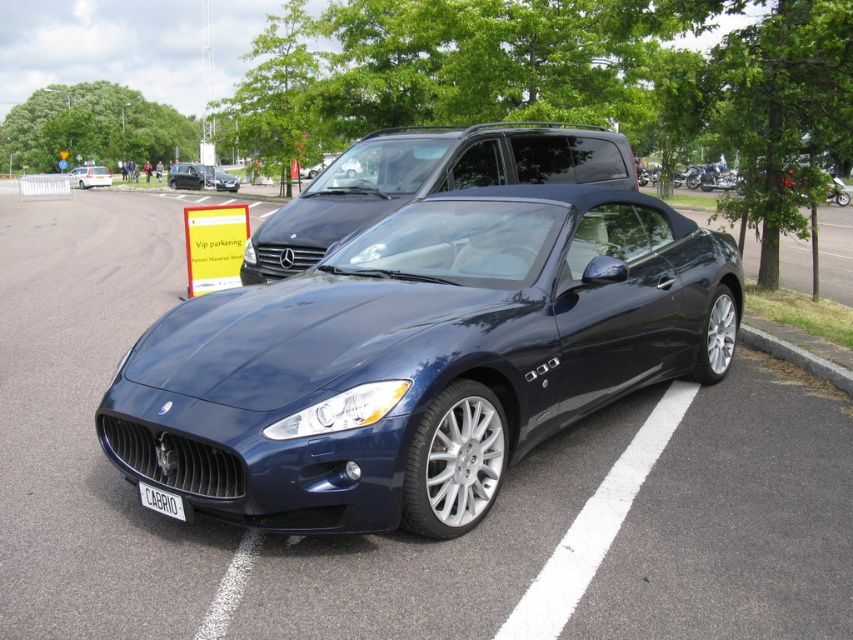
You are standing at the point marked by coordinates point (421, 358). What object are you directly facing?

The point (421, 358) marks the glossy metallic car at center, so you are directly facing the glossy metallic car at center.

You are a parking attendant and need to move the glossy black car at center into a parking spot that is the same size as the gray concrete curb at lower right. Will the car fit in the spot?

The glossy black car at center is wider than the gray concrete curb at lower right, so it will not fit in the parking spot.

You are a parking attendant trying to direct a driver to park their car. The driver needs to know if their vehicle will fit in the space between the glossy metallic car at center and the gray concrete curb at lower right. Can you confirm if the space is wide enough?

The glossy metallic car at center is in front of the gray concrete curb at lower right, so the space between them is sufficient for parking as long as the driver aligns their vehicle properly behind the glossy metallic car at center before the curb.